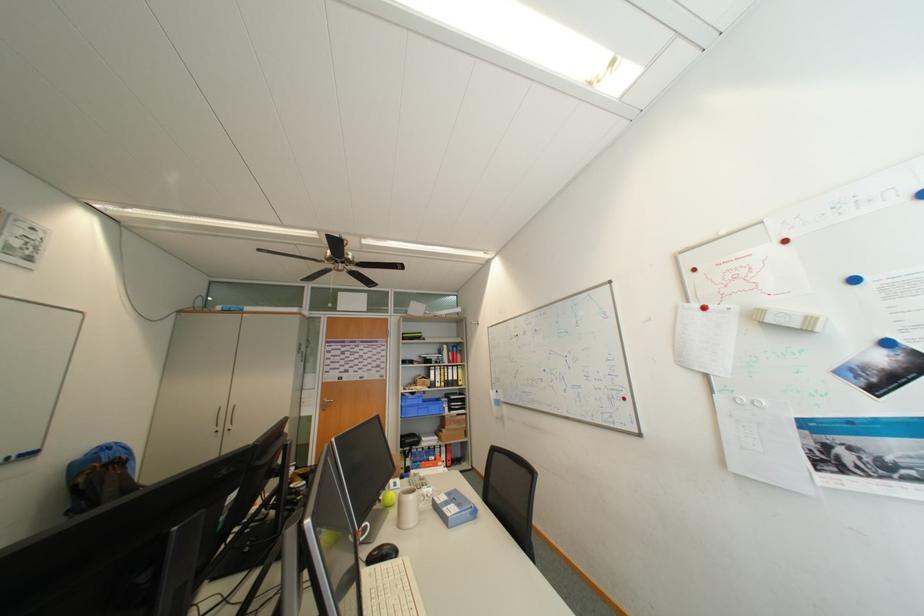
Where would you pull the fan pull chain? Please return your answer as a coordinate pair (x, y).

(334, 256)